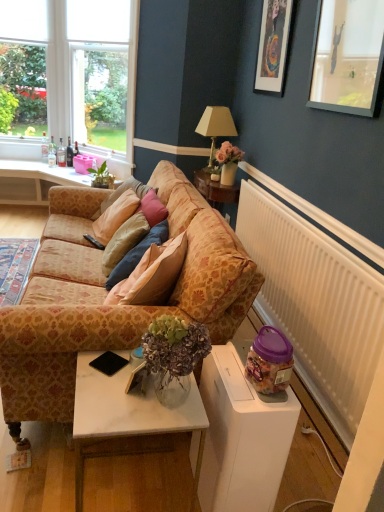
Question: From the image's perspective, is clear glass bottle at window, the fourth bottle when ordered from right to left, above or below dark brown glass bottle at left, placed as the 4th bottle when sorted from left to right?

Choices:
 (A) above
 (B) below

Answer: (A)

Question: Relative to dark brown glass bottle at left, positioned as the first bottle in right-to-left order, is clear glass bottle at window, the first bottle positioned from the left, in front or behind?

Choices:
 (A) front
 (B) behind

Answer: (B)

Question: Which object is the closest to the clear glass window at upper left?

Choices:
 (A) green leafy plant at center
 (B) clear glass bottle at left, the 2th bottle when ordered from right to left
 (C) white marble table at lower center
 (D) purple plastic jar at lower right
 (E) black plastic remote control at center

Answer: (B)

Question: Considering the real-world distances, which object is farthest from the clear glass bottle at window, the fourth bottle when ordered from right to left?

Choices:
 (A) clear glass bottle at left, the 2th bottle when ordered from right to left
 (B) patterned fabric couch at center
 (C) black matte phone at lower center
 (D) purple plastic jar at lower right
 (E) matte gold lamp at upper center

Answer: (D)